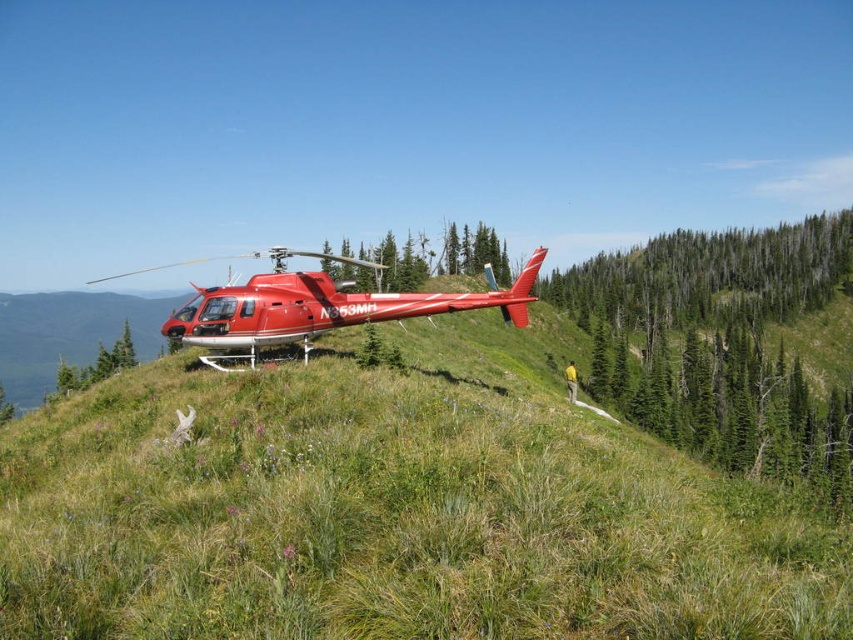
You are a pilot who just landed the helicopter at the point marked by the coordinates point (x=317, y=305). Based on the scene description, what is the color of the helicopter?

The helicopter marked by point (x=317, y=305) is shiny red.

You are a drone operator trying to capture a photo of the shiny red helicopter at center and the green textured tree at center. From your current position, which object will appear larger in the photo?

The shiny red helicopter at center will appear larger in the photo because it is closer to the viewer than the green textured tree at center.

You are a pilot who needs to ensure there is enough clearance between the shiny red helicopter at center and the green textured tree at center before taking off. Based on the scene provided, which object is taller and could potentially interfere with the takeoff path?

The shiny red helicopter at center is taller than the green textured tree at center, so the helicopter itself is the taller object and would be the one to consider for clearance during takeoff, not the tree.